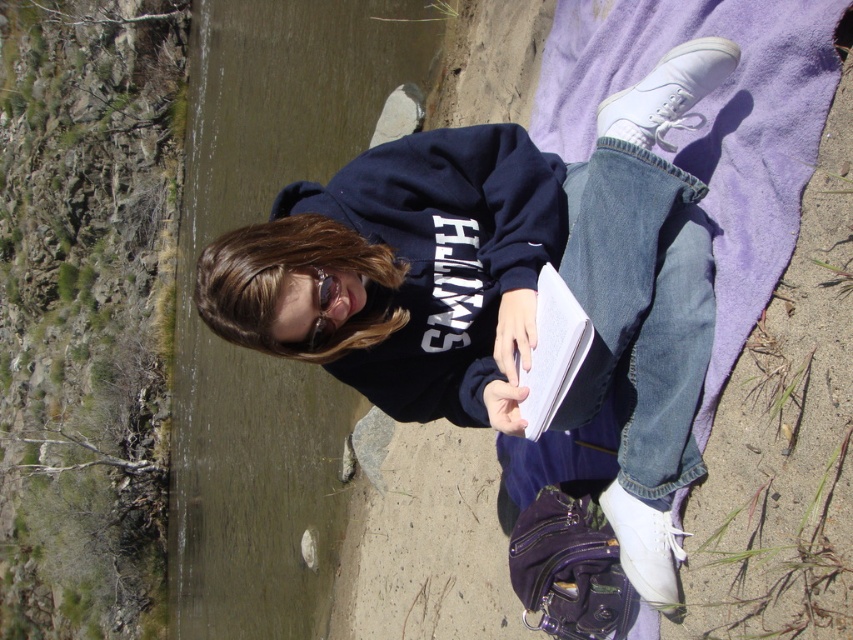
Question: Can you confirm if clear water at river left is bigger than black paper book at center?

Choices:
 (A) yes
 (B) no

Answer: (A)

Question: Which of the following is the closest to the observer?

Choices:
 (A) (267, 374)
 (B) (97, 436)
 (C) (631, 536)
 (D) (549, 369)

Answer: (D)

Question: Is the position of matte black hoodie at center more distant than that of black paper book at center?

Choices:
 (A) no
 (B) yes

Answer: (B)

Question: Does matte black hoodie at center lie in front of clear water at river left?

Choices:
 (A) no
 (B) yes

Answer: (B)

Question: Which of these objects is positioned closest to the clear water at river left?

Choices:
 (A) rugged rock cliff at left
 (B) matte black hoodie at center

Answer: (A)

Question: Among these objects, which one is farthest from the camera?

Choices:
 (A) black paper book at center
 (B) rugged rock cliff at left

Answer: (B)